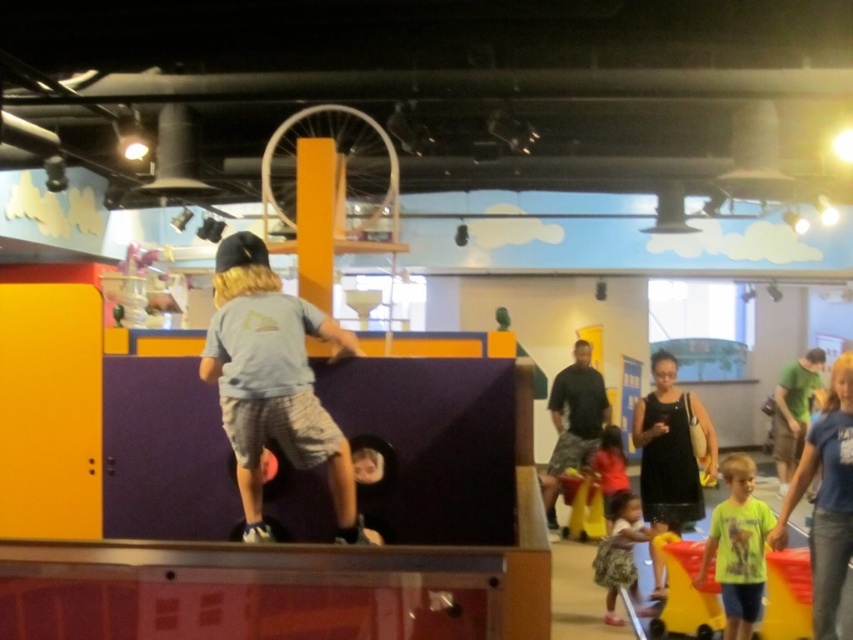
Question: Estimate the real-world distances between objects in this image. Which object is closer to the neon green t-shirt at lower right?

Choices:
 (A) dark gray camouflage shorts at center
 (B) printed floral dress at lower right
 (C) light blue shirt at center

Answer: (B)

Question: Which of these objects is positioned farthest from the light blue shirt at center?

Choices:
 (A) gray cotton shirt at center
 (B) dark gray camouflage shorts at center

Answer: (A)

Question: Can you confirm if green t-shirt at lower right is thinner than light blue shirt at center?

Choices:
 (A) no
 (B) yes

Answer: (A)

Question: Can you confirm if gray cotton shirt at center is positioned to the left of dark gray camouflage shorts at center?

Choices:
 (A) no
 (B) yes

Answer: (B)

Question: Which point is farther from the camera taking this photo?

Choices:
 (A) (637, 540)
 (B) (743, 476)

Answer: (A)

Question: Is black dress at center wider than green t-shirt at lower right?

Choices:
 (A) no
 (B) yes

Answer: (B)